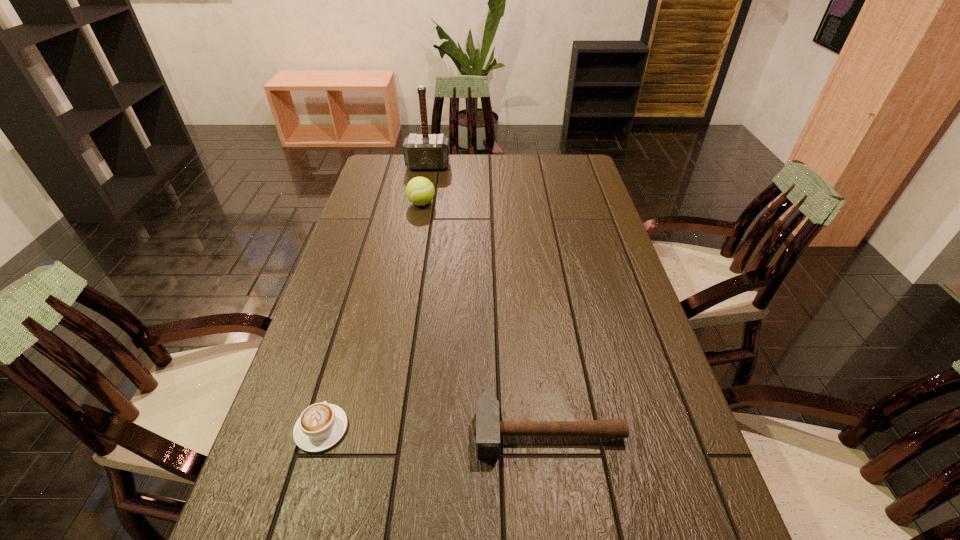
I want to click on free region at the right edge of the desktop, so click(597, 210).

In the image, there is a desktop. Where is `vacant space at the far right corner`? The image size is (960, 540). vacant space at the far right corner is located at coordinates (570, 182).

I want to click on free spot between the cappuccino and the nearer hammer, so click(x=435, y=429).

Where is `empty space between the tennis ball and the cappuccino`? This screenshot has width=960, height=540. empty space between the tennis ball and the cappuccino is located at coordinates (372, 316).

The width and height of the screenshot is (960, 540). I want to click on blank region between the tallest object and the right hammer, so click(488, 298).

I want to click on free point between the farther hammer and the shortest object, so click(x=374, y=297).

The width and height of the screenshot is (960, 540). In order to click on free space between the cappuccino and the tennis ball in this screenshot , I will do `click(372, 316)`.

The width and height of the screenshot is (960, 540). Identify the location of object that stands as the third closest to the second farthest object. (488, 428).

Choose which object is the third nearest neighbor to the nearer hammer. Please provide its 2D coordinates. Your answer should be formatted as a tuple, i.e. [(x, y)], where the tuple contains the x and y coordinates of a point satisfying the conditions above.

[(425, 151)]

This screenshot has width=960, height=540. Identify the location of vacant space that satisfies the following two spatial constraints: 1. with the handle on the right side of the shortest object; 2. on the left side of the tennis ball. (386, 204).